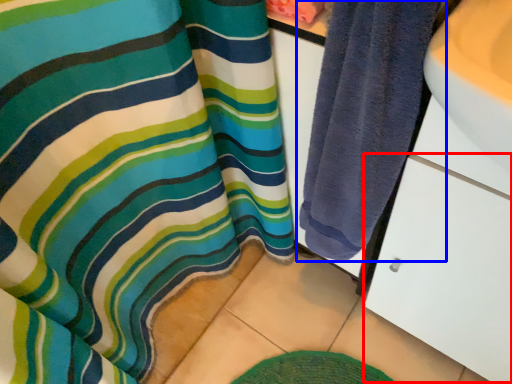
Question: Among these objects, which one is nearest to the camera, drawer (highlighted by a red box) or towel (highlighted by a blue box)?

Choices:
 (A) drawer
 (B) towel

Answer: (A)